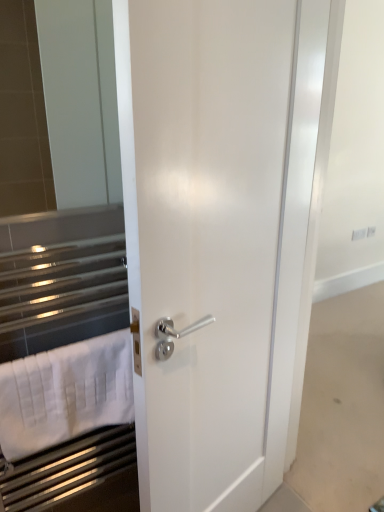
The image size is (384, 512). Describe the element at coordinates (65, 393) in the screenshot. I see `white cotton bath towel at left` at that location.

I want to click on white cotton bath towel at left, so click(65, 393).

What is the approximate height of white cotton bath towel at left?

It is 10.14 inches.

Identify the location of white glossy door at center. This screenshot has width=384, height=512. 205,239.

The height and width of the screenshot is (512, 384). What do you see at coordinates (205, 239) in the screenshot? I see `white glossy door at center` at bounding box center [205, 239].

What is the approximate height of white glossy door at center?

It is 5.65 feet.

Where is `white cotton bath towel at left`? The image size is (384, 512). white cotton bath towel at left is located at coordinates (65, 393).

Between white cotton bath towel at left and white glossy door at center, which one appears on the right side from the viewer's perspective?

white glossy door at center.

Which object is closer to the camera taking this photo, white cotton bath towel at left or white glossy door at center?

white glossy door at center is more forward.

Which is further, (89,397) or (226,258)?

Positioned behind is point (89,397).

From the image's perspective, does white cotton bath towel at left appear lower than white glossy door at center?

Yes.

From a real-world perspective, which is physically above, white cotton bath towel at left or white glossy door at center?

white glossy door at center, from a real-world perspective.

Between white cotton bath towel at left and white glossy door at center, which one has larger width?

white glossy door at center.

Between white cotton bath towel at left and white glossy door at center, which one has more height?

Standing taller between the two is white glossy door at center.

Between white cotton bath towel at left and white glossy door at center, which one has larger size?

With larger size is white glossy door at center.

Consider the image. Choose the correct answer: Is white cotton bath towel at left inside white glossy door at center or outside it?

Answer: white cotton bath towel at left is located beyond the bounds of white glossy door at center.

Is white cotton bath towel at left positioned far away from white glossy door at center?

That's not correct — white cotton bath towel at left is a little close to white glossy door at center.

Could you tell me if white cotton bath towel at left is turned towards white glossy door at center?

No, white cotton bath towel at left is not turned towards white glossy door at center.

Where is `bath towel on the left of white glossy door at center`? bath towel on the left of white glossy door at center is located at coordinates (65, 393).

Considering the positions of objects white glossy door at center and white cotton bath towel at left in the image provided, who is more to the left, white glossy door at center or white cotton bath towel at left?

white cotton bath towel at left.

Which is behind, white glossy door at center or white cotton bath towel at left?

white cotton bath towel at left is more distant.

Between point (206, 429) and point (79, 419), which one is positioned behind?

Positioned behind is point (206, 429).

From the image's perspective, is white glossy door at center on top of white cotton bath towel at left?

Yes, from the image's perspective, white glossy door at center is above white cotton bath towel at left.

From a real-world perspective, who is located lower, white glossy door at center or white cotton bath towel at left?

white cotton bath towel at left.

Considering the sizes of white glossy door at center and white cotton bath towel at left in the image, is white glossy door at center wider or thinner than white cotton bath towel at left?

Clearly, white glossy door at center has more width compared to white cotton bath towel at left.

Considering the sizes of objects white glossy door at center and white cotton bath towel at left in the image provided, who is taller, white glossy door at center or white cotton bath towel at left?

Standing taller between the two is white glossy door at center.

Looking at the image, does white glossy door at center seem bigger or smaller compared to white cotton bath towel at left?

In the image, white glossy door at center appears to be larger than white cotton bath towel at left.

Is white glossy door at center situated inside white cotton bath towel at left or outside?

white glossy door at center is spatially situated outside white cotton bath towel at left.

Is white glossy door at center with white cotton bath towel at left?

No, white glossy door at center is not beside white cotton bath towel at left.

Is white cotton bath towel at left at the back of white glossy door at center?

That's not correct — white glossy door at center is not looking away from white cotton bath towel at left.

What's the angular difference between white glossy door at center and white cotton bath towel at left's facing directions?

The facing directions of white glossy door at center and white cotton bath towel at left are 13.1 degrees apart.

Where is `door that appears above the white cotton bath towel at left (from a real-world perspective)`? door that appears above the white cotton bath towel at left (from a real-world perspective) is located at coordinates (205, 239).

At what (x,y) coordinates should I click in order to perform the action: click on door that appears in front of the white cotton bath towel at left. Please return your answer as a coordinate pair (x, y). This screenshot has width=384, height=512. Looking at the image, I should click on (205, 239).

Identify the location of door that appears above the white cotton bath towel at left (from the image's perspective). (205, 239).